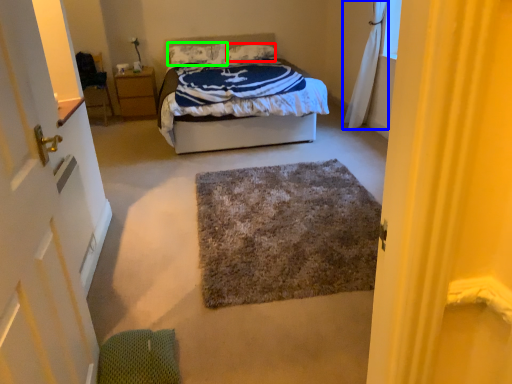
Question: Considering the real-world distances, which object is closest to pillow (highlighted by a red box)? curtain (highlighted by a blue box) or pillow (highlighted by a green box).

Choices:
 (A) curtain
 (B) pillow

Answer: (B)